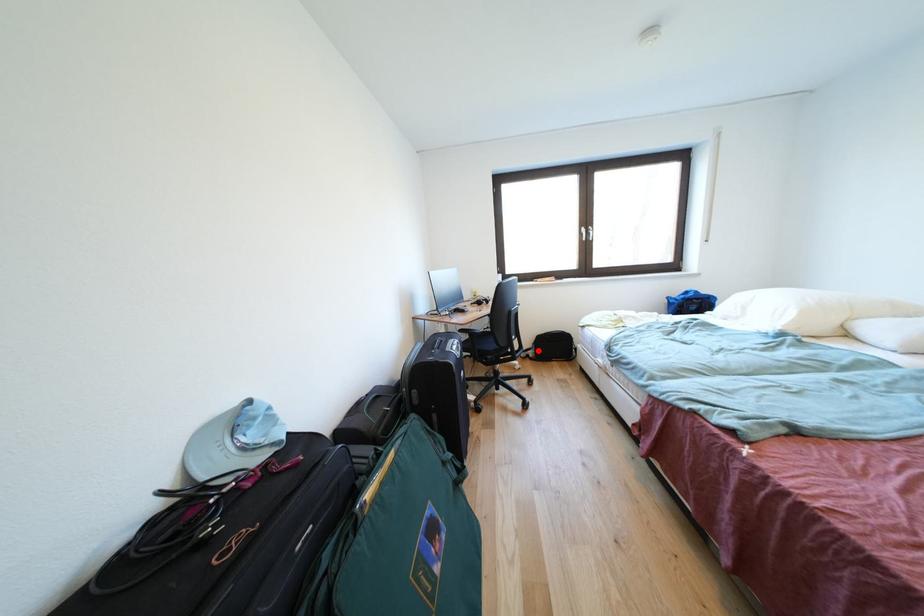
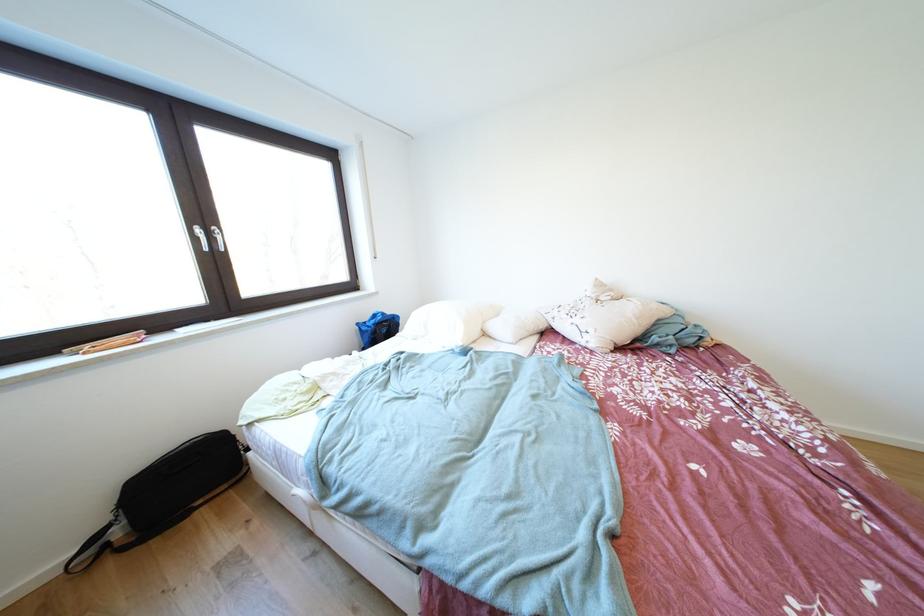
Where in the second image is the point corresponding to the highlighted location from the first image?

(114, 524)